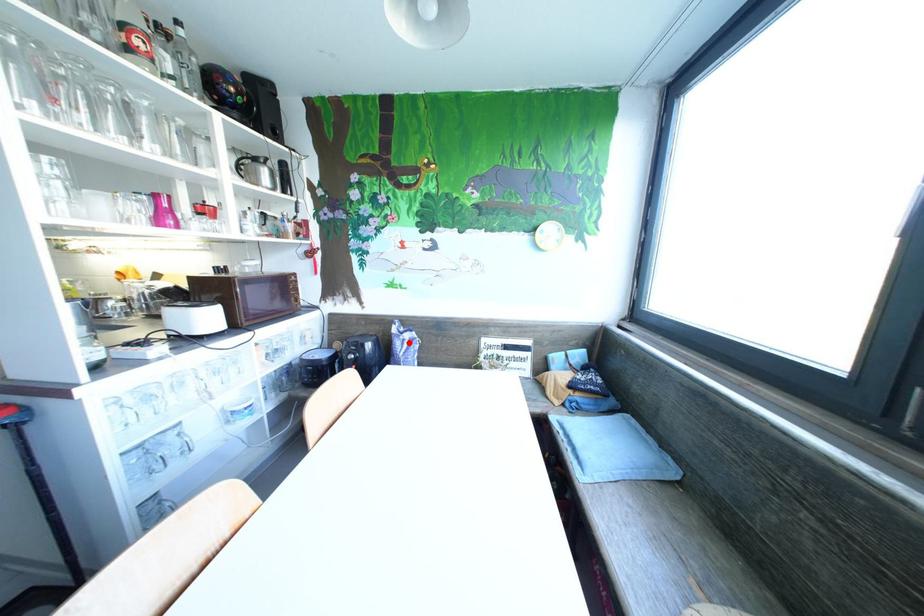
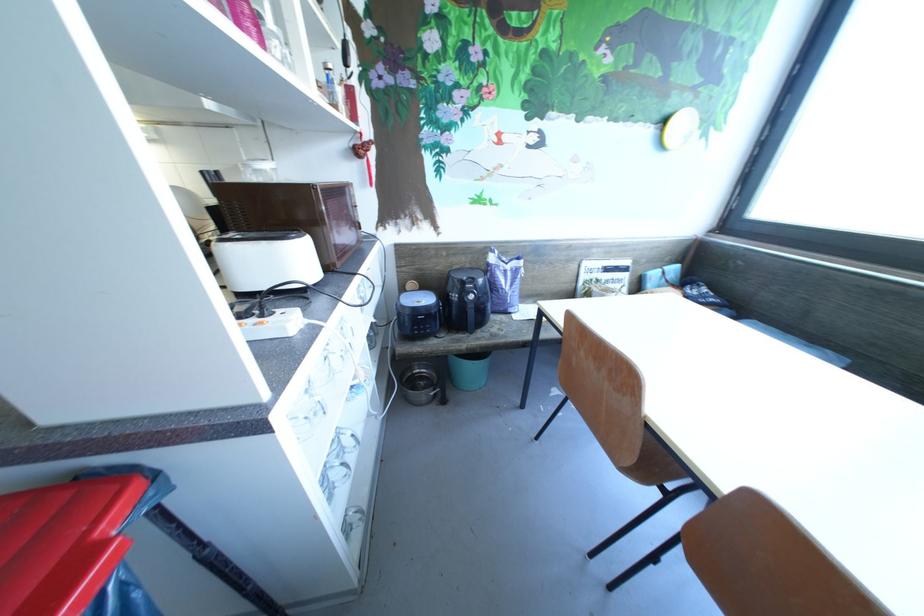
Question: I am providing you with two images of the same scene from different viewpoints. A red point is shown in image1. For the corresponding object point in image2, is it positioned nearer or farther from the camera?

Choices:
 (A) Nearer
 (B) Farther

Answer: (A)